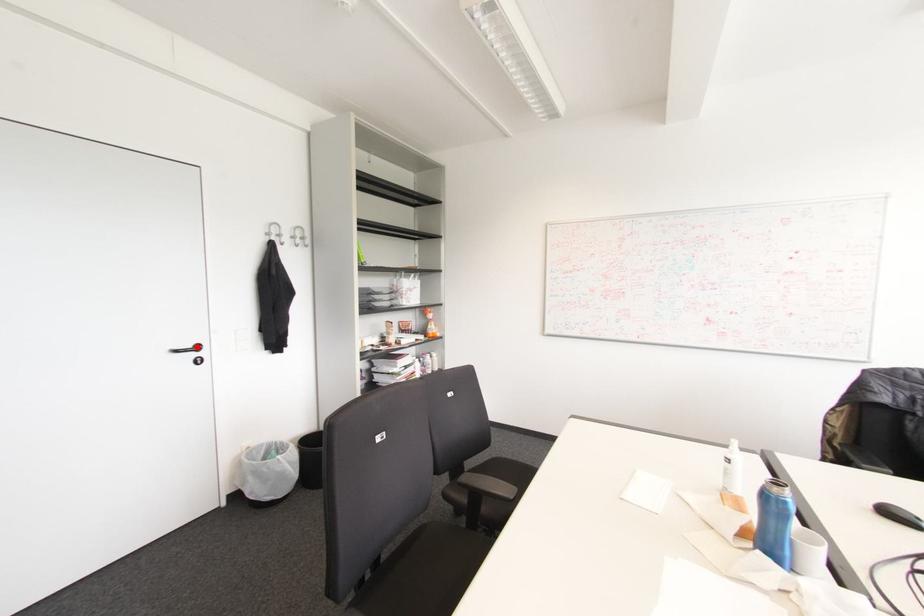
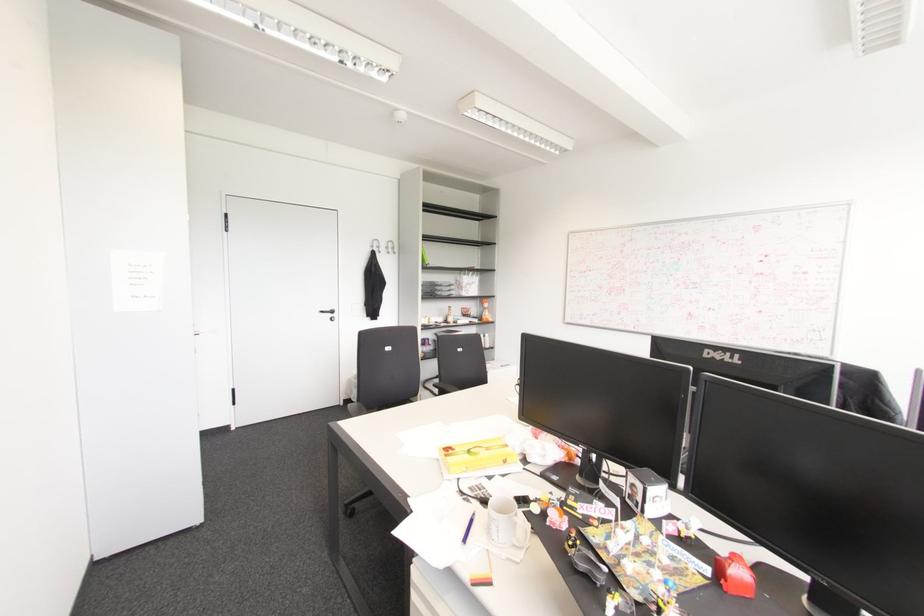
Where in the second image is the point corresponding to the highlighted location from the first image?

(332, 310)